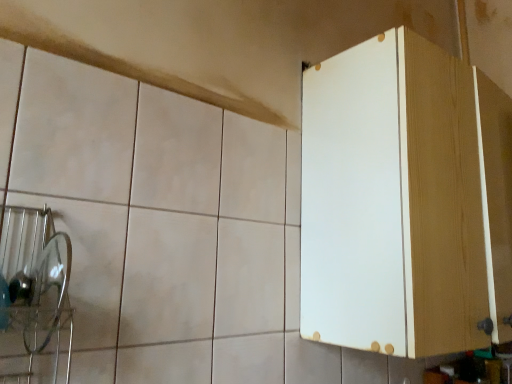
Question: Looking at their shapes, would you say white wood cabinet at right is wider or thinner than translucent glass plate at left?

Choices:
 (A) thin
 (B) wide

Answer: (B)

Question: Is white wood cabinet at right inside or outside of translucent glass plate at left?

Choices:
 (A) outside
 (B) inside

Answer: (A)

Question: Is point (330, 91) positioned closer to the camera than point (57, 223)?

Choices:
 (A) closer
 (B) farther

Answer: (B)

Question: In the image, is translucent glass plate at left on the left side or the right side of white wood cabinet at right?

Choices:
 (A) left
 (B) right

Answer: (A)

Question: From a real-world perspective, relative to white wood cabinet at right, is translucent glass plate at left vertically above or below?

Choices:
 (A) below
 (B) above

Answer: (A)

Question: Is translucent glass plate at left in front of or behind white wood cabinet at right in the image?

Choices:
 (A) behind
 (B) front

Answer: (B)

Question: From the image's perspective, is translucent glass plate at left positioned above or below white wood cabinet at right?

Choices:
 (A) below
 (B) above

Answer: (A)